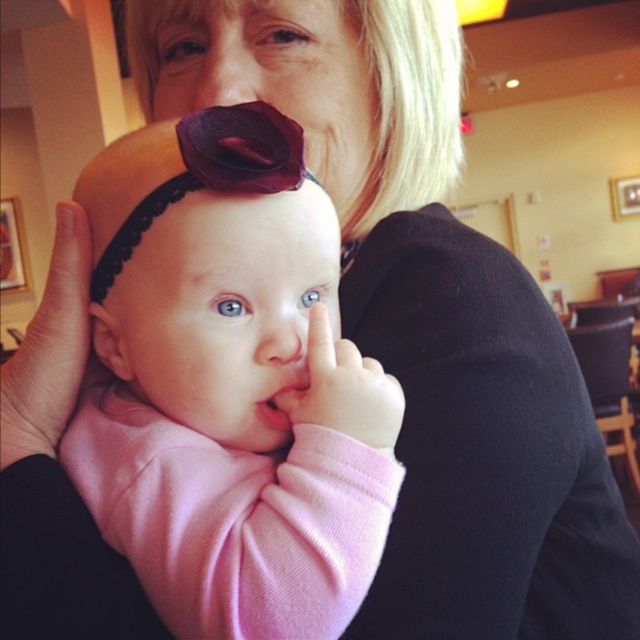
Who is higher up, pink satin headband at center or matte purple flower at center?

matte purple flower at center is above.

Between point (248, 572) and point (216, 74), which one is positioned behind?

Point (216, 74)

Is point (284, 509) farther from camera compared to point (236, 67)?

No, (284, 509) is in front of (236, 67).

Where is `pink satin headband at center`? The height and width of the screenshot is (640, 640). pink satin headband at center is located at coordinates (228, 385).

Who is higher up, pink fabric at center or matte purple flower at center?

matte purple flower at center is higher up.

Is pink fabric at center behind matte purple flower at center?

No.

This screenshot has width=640, height=640. Describe the element at coordinates (56, 474) in the screenshot. I see `pink fabric at center` at that location.

At what (x,y) coordinates should I click in order to perform the action: click on pink fabric at center. Please return your answer as a coordinate pair (x, y). The image size is (640, 640). Looking at the image, I should click on (56, 474).

Is pink satin headband at center taller than smooth skin nose at center?

Indeed, pink satin headband at center has a greater height compared to smooth skin nose at center.

Is the position of pink satin headband at center more distant than that of smooth skin nose at center?

No, pink satin headband at center is closer to the viewer.

Does point (369, 464) come in front of point (292, 312)?

Yes, it is in front of point (292, 312).

The width and height of the screenshot is (640, 640). What are the coordinates of `pink satin headband at center` in the screenshot? It's located at (228, 385).